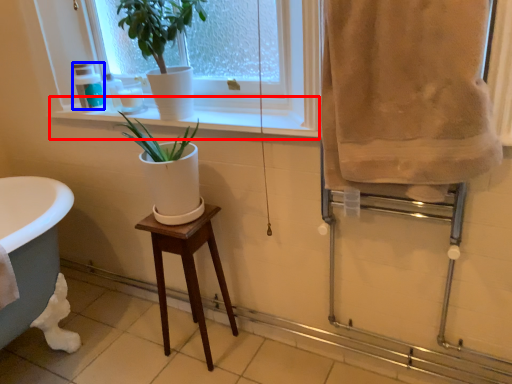
Question: Which object is closer to the camera taking this photo, window sill (highlighted by a red box) or toiletry (highlighted by a blue box)?

Choices:
 (A) window sill
 (B) toiletry

Answer: (A)